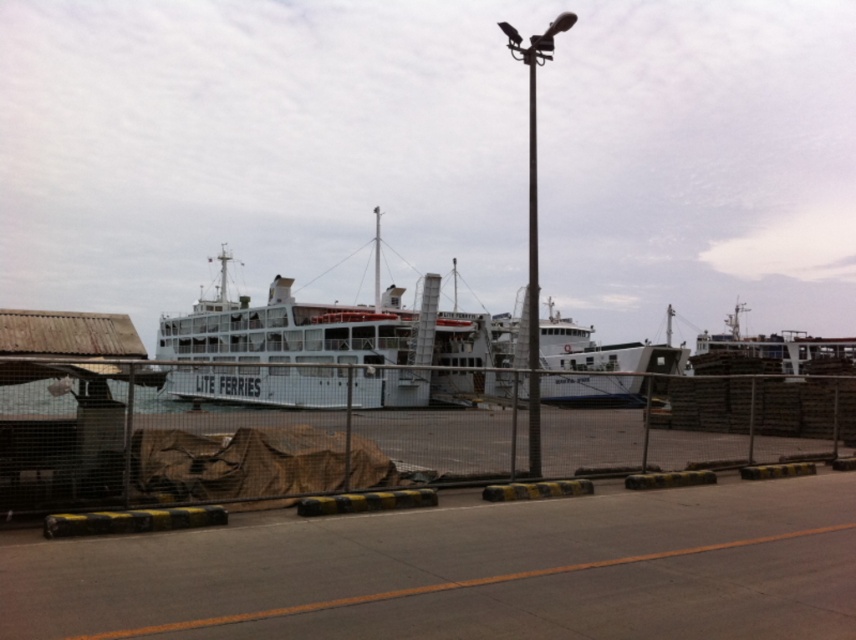
Can you confirm if metallic pole at center is shorter than polished metal pole at center?

No, metallic pole at center is not shorter than polished metal pole at center.

Does metallic pole at center have a lesser width compared to polished metal pole at center?

Incorrect, metallic pole at center's width is not less than polished metal pole at center's.

Between point (538, 476) and point (533, 284), which one is positioned in front?

Point (538, 476)

This screenshot has height=640, width=856. I want to click on metallic pole at center, so click(535, 216).

Can you confirm if white matte ferry at center is wider than metallic pole at center?

Correct, the width of white matte ferry at center exceeds that of metallic pole at center.

Can you confirm if white matte ferry at center is positioned to the left of metallic pole at center?

Indeed, white matte ferry at center is positioned on the left side of metallic pole at center.

Where is `white matte ferry at center`? This screenshot has width=856, height=640. white matte ferry at center is located at coordinates (343, 349).

Does white matte ferry at center have a smaller size compared to polished metal pole at center?

Correct, white matte ferry at center occupies less space than polished metal pole at center.

Is white matte ferry at center behind polished metal pole at center?

That is False.

Which is in front, point (456, 310) or point (532, 150)?

Positioned in front is point (456, 310).

The width and height of the screenshot is (856, 640). Identify the location of white matte ferry at center. (343, 349).